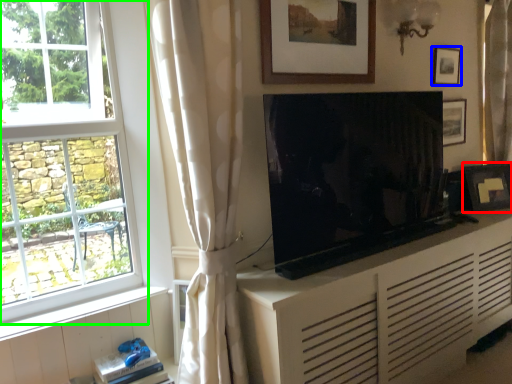
Question: Estimate the real-world distances between objects in this image. Which object is farther from picture frame (highlighted by a red box), picture frame (highlighted by a blue box) or window (highlighted by a green box)?

Choices:
 (A) picture frame
 (B) window

Answer: (B)